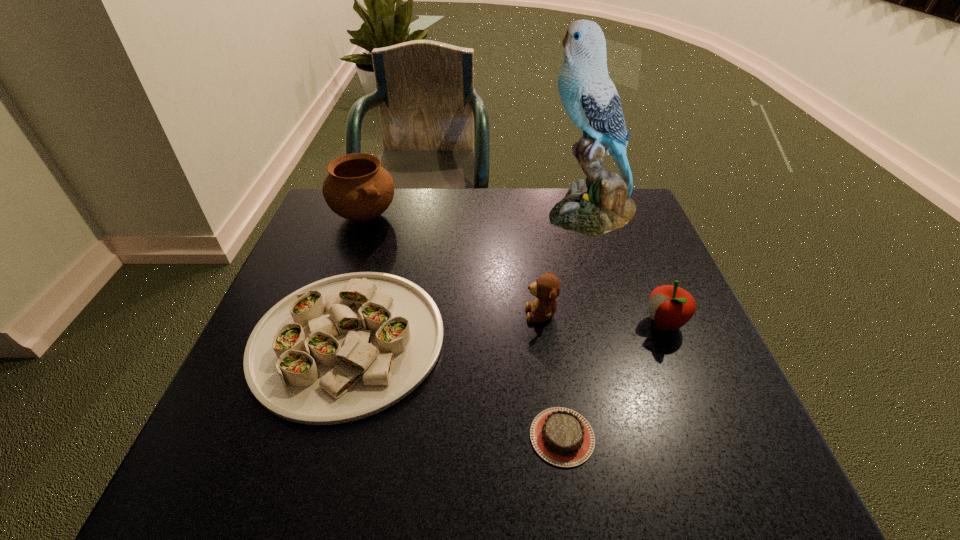
Find the location of a particular element. This screenshot has width=960, height=540. vacant region located 0.110m on the back of the apple is located at coordinates (644, 274).

Find the location of `free point located on the face of the teddy bear`. free point located on the face of the teddy bear is located at coordinates (484, 314).

You are a GUI agent. You are given a task and a screenshot of the screen. Output one action in this format:
    pyautogui.click(x=<x>, y=<y>)
    Task: Click on the free space located 0.130m on the face of the teddy bear
    
    Given the screenshot: What is the action you would take?
    pyautogui.click(x=465, y=314)

Find the location of a particular element. This screenshot has width=960, height=540. free location located 0.100m on the face of the teddy bear is located at coordinates (479, 314).

Identify the location of free spot located 0.140m on the right of the fifth tallest object. click(x=513, y=340).

At what (x,y) coordinates should I click in order to perform the action: click on blank space located on the left of the chocolate cake. Please return your answer as a coordinate pair (x, y). The image size is (960, 540). Looking at the image, I should click on (470, 437).

You are a GUI agent. You are given a task and a screenshot of the screen. Output one action in this format:
    pyautogui.click(x=<x>, y=<y>)
    Task: Click on the parakeet at the far edge
    This screenshot has width=960, height=540.
    Given the screenshot: What is the action you would take?
    pyautogui.click(x=589, y=96)

Find the location of a particular element. The height and width of the screenshot is (540, 960). pottery that is at the far edge is located at coordinates (357, 188).

Image resolution: width=960 pixels, height=540 pixels. Identify the location of object at the near edge. (561, 436).

Find the location of a particular element. The image size is (960, 540). pottery that is at the left edge is located at coordinates (357, 188).